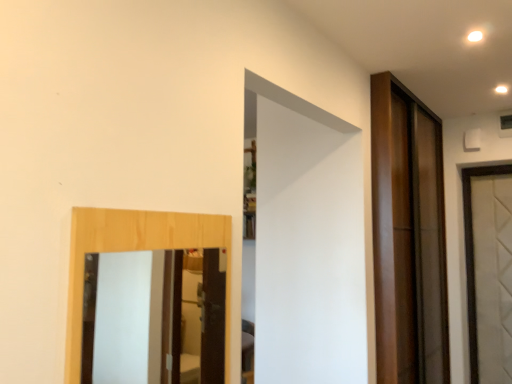
This screenshot has width=512, height=384. I want to click on wooden-framed mirror at left, so click(154, 318).

This screenshot has height=384, width=512. What do you see at coordinates (154, 318) in the screenshot?
I see `wooden-framed mirror at left` at bounding box center [154, 318].

What is the approximate width of wooden-framed mirror at left?

wooden-framed mirror at left is 1.25 inches wide.

This screenshot has height=384, width=512. What do you see at coordinates (408, 237) in the screenshot? I see `shiny brown door at right` at bounding box center [408, 237].

Measure the distance between point (x=398, y=98) and camera.

Point (x=398, y=98) and camera are 8.07 feet apart from each other.

This screenshot has height=384, width=512. What are the coordinates of `shiny brown door at right` in the screenshot? It's located at (408, 237).

At what (x,y) coordinates should I click in order to perform the action: click on wooden-framed mirror at left. Please return your answer as a coordinate pair (x, y). This screenshot has width=512, height=384. Looking at the image, I should click on (x=154, y=318).

Does wooden-framed mirror at left appear on the right side of shiny brown door at right?

In fact, wooden-framed mirror at left is to the left of shiny brown door at right.

Between wooden-framed mirror at left and shiny brown door at right, which one is positioned behind?

shiny brown door at right is more distant.

Which point is more distant from viewer, (168, 314) or (387, 328)?

The point (168, 314) is farther from the camera.

From the image's perspective, is wooden-framed mirror at left above shiny brown door at right?

Yes, from the image's perspective, wooden-framed mirror at left is over shiny brown door at right.

From a real-world perspective, between wooden-framed mirror at left and shiny brown door at right, who is vertically lower?

In real-world perspective, wooden-framed mirror at left is lower.

Does wooden-framed mirror at left have a lesser width compared to shiny brown door at right?

Correct, the width of wooden-framed mirror at left is less than that of shiny brown door at right.

Which of these two, wooden-framed mirror at left or shiny brown door at right, stands shorter?

wooden-framed mirror at left.

Between wooden-framed mirror at left and shiny brown door at right, which one has smaller size?

Result: wooden-framed mirror at left is smaller.

Is wooden-framed mirror at left outside of shiny brown door at right?

Indeed, wooden-framed mirror at left is completely outside shiny brown door at right.

Is wooden-framed mirror at left in contact with shiny brown door at right?

No.

Is wooden-framed mirror at left positioned with its back to shiny brown door at right?

No.

How many degrees apart are the facing directions of wooden-framed mirror at left and shiny brown door at right?

They differ by 0.375 degrees in their facing directions.

Locate an element on the screen. The height and width of the screenshot is (384, 512). mirror that appears above the shiny brown door at right (from the image's perspective) is located at coordinates (154, 318).

Which is more to the left, shiny brown door at right or wooden-framed mirror at left?

wooden-framed mirror at left is more to the left.

Which object is closer to the camera taking this photo, shiny brown door at right or wooden-framed mirror at left?

Positioned in front is wooden-framed mirror at left.

Is point (446, 341) positioned before point (154, 317)?

Yes, point (446, 341) is closer to viewer.

From the image's perspective, which one is positioned higher, shiny brown door at right or wooden-framed mirror at left?

From the image's view, wooden-framed mirror at left is above.

From a real-world perspective, is shiny brown door at right under wooden-framed mirror at left?

No.

Between shiny brown door at right and wooden-framed mirror at left, which one has larger width?

shiny brown door at right is wider.

Between shiny brown door at right and wooden-framed mirror at left, which one has less height?

wooden-framed mirror at left.

Is shiny brown door at right smaller than wooden-framed mirror at left?

No.

Can wooden-framed mirror at left be found inside shiny brown door at right?

Definitely not — wooden-framed mirror at left is not inside shiny brown door at right.

Are shiny brown door at right and wooden-framed mirror at left far apart?

Yes, shiny brown door at right is far from wooden-framed mirror at left.

Is shiny brown door at right facing towards wooden-framed mirror at left?

No, shiny brown door at right is not facing towards wooden-framed mirror at left.

How many degrees apart are the facing directions of shiny brown door at right and wooden-framed mirror at left?

0.375 degrees.

How much distance is there between shiny brown door at right and wooden-framed mirror at left?

They are 4.88 feet apart.

You are a GUI agent. You are given a task and a screenshot of the screen. Output one action in this format:
    pyautogui.click(x=<x>, y=<y>)
    Task: Click on the mirror in front of the shiny brown door at right
    The height and width of the screenshot is (384, 512).
    Given the screenshot: What is the action you would take?
    pyautogui.click(x=154, y=318)

This screenshot has height=384, width=512. In order to click on door above the wooden-framed mirror at left (from a real-world perspective) in this screenshot , I will do `click(408, 237)`.

In the image, there is a wooden-framed mirror at left. Identify the location of door below it (from the image's perspective). (408, 237).